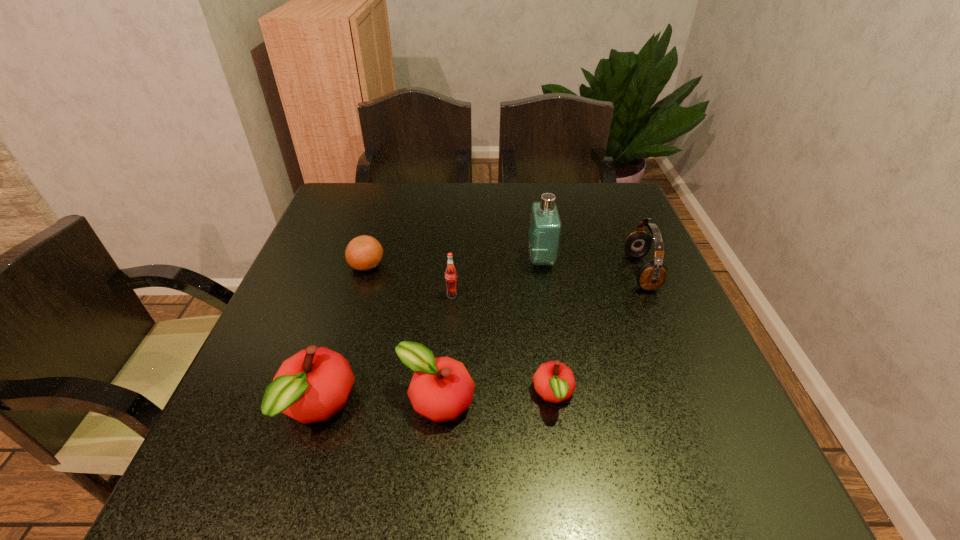
Choose which object is the sixth nearest neighbor to the leftmost apple. Please provide its 2D coordinates. Your answer should be formatted as a tuple, i.e. [(x, y)], where the tuple contains the x and y coordinates of a point satisfying the conditions above.

[(652, 275)]

In order to click on apple identified as the second closest to the third shortest object in this screenshot , I will do `click(554, 382)`.

Locate an element on the screen. Image resolution: width=960 pixels, height=540 pixels. the third closest apple to the soda bottle is located at coordinates (554, 382).

The height and width of the screenshot is (540, 960). I want to click on vacant position in the image that satisfies the following two spatial constraints: 1. on the back side of the clementine; 2. on the right side of the leftmost apple, so click(x=362, y=265).

Image resolution: width=960 pixels, height=540 pixels. Find the location of `free space that satisfies the following two spatial constraints: 1. on the front label of the perfume; 2. on the front side of the leftmost apple`. free space that satisfies the following two spatial constraints: 1. on the front label of the perfume; 2. on the front side of the leftmost apple is located at coordinates (565, 407).

You are a GUI agent. You are given a task and a screenshot of the screen. Output one action in this format:
    pyautogui.click(x=<x>, y=<y>)
    Task: Click on the free space that satisfies the following two spatial constraints: 1. on the front side of the second apple from left to right; 2. on the right side of the clementine
    
    Given the screenshot: What is the action you would take?
    pyautogui.click(x=324, y=401)

Where is `free region that satisfies the following two spatial constraints: 1. on the ear cups of the rightmost object; 2. on the label of the soda bottle`? The width and height of the screenshot is (960, 540). free region that satisfies the following two spatial constraints: 1. on the ear cups of the rightmost object; 2. on the label of the soda bottle is located at coordinates (650, 295).

Where is `free point that satisfies the following two spatial constraints: 1. on the front side of the clementine; 2. on the right side of the second apple from left to right`? The width and height of the screenshot is (960, 540). free point that satisfies the following two spatial constraints: 1. on the front side of the clementine; 2. on the right side of the second apple from left to right is located at coordinates (324, 401).

You are a GUI agent. You are given a task and a screenshot of the screen. Output one action in this format:
    pyautogui.click(x=<x>, y=<y>)
    Task: Click on the free location that satisfies the following two spatial constraints: 1. on the ear cups of the rightmost object; 2. on the label of the soda bottle
    Image resolution: width=960 pixels, height=540 pixels.
    Given the screenshot: What is the action you would take?
    pyautogui.click(x=650, y=295)

At what (x,y) coordinates should I click in order to perform the action: click on free space that satisfies the following two spatial constraints: 1. on the ear cups of the headset; 2. on the front side of the leftmost apple. Please return your answer as a coordinate pair (x, y). The width and height of the screenshot is (960, 540). Looking at the image, I should click on (698, 407).